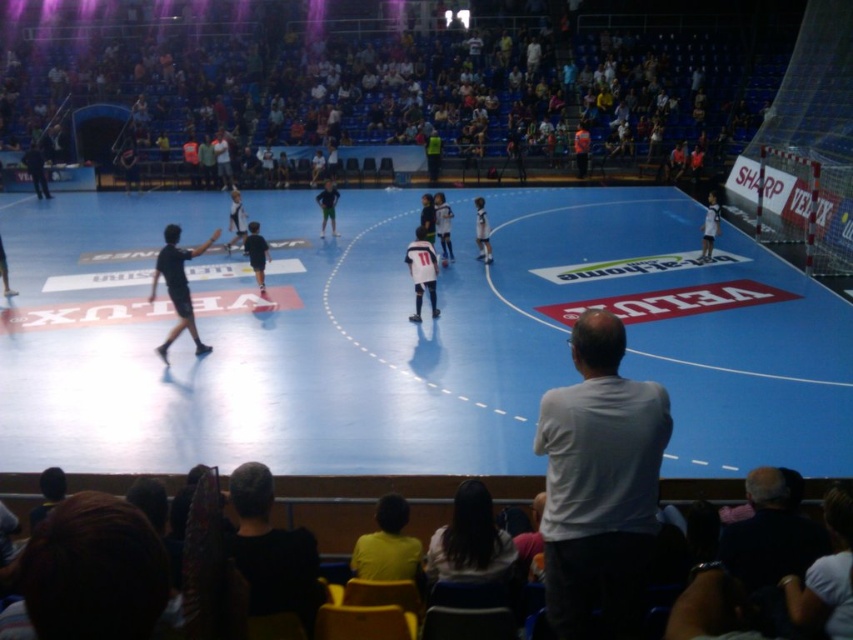
Is point (460, 483) closer to viewer compared to point (427, 259)?

Yes.

Is point (502, 563) positioned after point (413, 312)?

No, (502, 563) is closer to viewer.

You are a GUI agent. You are given a task and a screenshot of the screen. Output one action in this format:
    pyautogui.click(x=<x>, y=<y>)
    Task: Click on the dark brown hair at lower center
    
    Given the screenshot: What is the action you would take?
    pyautogui.click(x=469, y=540)

Is point (509, 198) more distant than point (578, 547)?

Yes, point (509, 198) is behind point (578, 547).

Measure the distance from blue rubber basketball court at center to white matte shirt at center.

A distance of 8.11 meters exists between blue rubber basketball court at center and white matte shirt at center.

What do you see at coordinates (403, 340) in the screenshot? I see `blue rubber basketball court at center` at bounding box center [403, 340].

Where is `blue rubber basketball court at center`? The height and width of the screenshot is (640, 853). blue rubber basketball court at center is located at coordinates (403, 340).

Does point (630, 404) come behind point (405, 253)?

No, (630, 404) is in front of (405, 253).

Does white matte shirt at center have a lesser width compared to white jersey at center?

No.

Describe the element at coordinates (599, 483) in the screenshot. I see `white matte shirt at center` at that location.

Locate an element on the screen. white matte shirt at center is located at coordinates (599, 483).